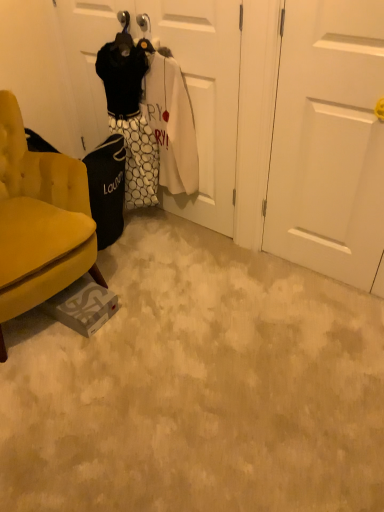
Question: Is white matte door at center, which ranks as the 2th door in right-to-left order, at the back of white matte door at center, which appears as the second door when viewed from the left?

Choices:
 (A) yes
 (B) no

Answer: (B)

Question: Is white matte door at center, marked as the 1th door in a right-to-left arrangement, wider than white matte door at center, which ranks as the 2th door in right-to-left order?

Choices:
 (A) yes
 (B) no

Answer: (A)

Question: From the image's perspective, is white matte door at center, marked as the 1th door in a right-to-left arrangement, beneath white matte door at center, which is the 1th door in left-to-right order?

Choices:
 (A) yes
 (B) no

Answer: (A)

Question: Does white matte door at center, which appears as the second door when viewed from the left, contain white matte door at center, which is the 1th door in left-to-right order?

Choices:
 (A) yes
 (B) no

Answer: (B)

Question: Is white matte door at center, which appears as the second door when viewed from the left, closer to the viewer compared to white matte door at center, which ranks as the 2th door in right-to-left order?

Choices:
 (A) no
 (B) yes

Answer: (B)

Question: Is the position of white matte door at center, which appears as the second door when viewed from the left, more distant than that of white matte door at center, which is the 1th door in left-to-right order?

Choices:
 (A) yes
 (B) no

Answer: (B)

Question: From a real-world perspective, is velvet yellow armchair at lower left positioned under white matte door at center, which appears as the second door when viewed from the left, based on gravity?

Choices:
 (A) no
 (B) yes

Answer: (B)

Question: Is velvet yellow armchair at lower left positioned with its back to white matte door at center, marked as the 1th door in a right-to-left arrangement?

Choices:
 (A) yes
 (B) no

Answer: (B)

Question: Does velvet yellow armchair at lower left have a greater width compared to white matte door at center, which appears as the second door when viewed from the left?

Choices:
 (A) yes
 (B) no

Answer: (A)

Question: Is velvet yellow armchair at lower left behind white matte door at center, marked as the 1th door in a right-to-left arrangement?

Choices:
 (A) no
 (B) yes

Answer: (A)

Question: Is velvet yellow armchair at lower left positioned beyond the bounds of white matte door at center, marked as the 1th door in a right-to-left arrangement?

Choices:
 (A) yes
 (B) no

Answer: (A)

Question: Is velvet yellow armchair at lower left touching white matte door at center, which appears as the second door when viewed from the left?

Choices:
 (A) yes
 (B) no

Answer: (B)

Question: Considering the relative sizes of white matte door at center, which appears as the second door when viewed from the left, and velvet yellow armchair at lower left in the image provided, is white matte door at center, which appears as the second door when viewed from the left, taller than velvet yellow armchair at lower left?

Choices:
 (A) yes
 (B) no

Answer: (A)